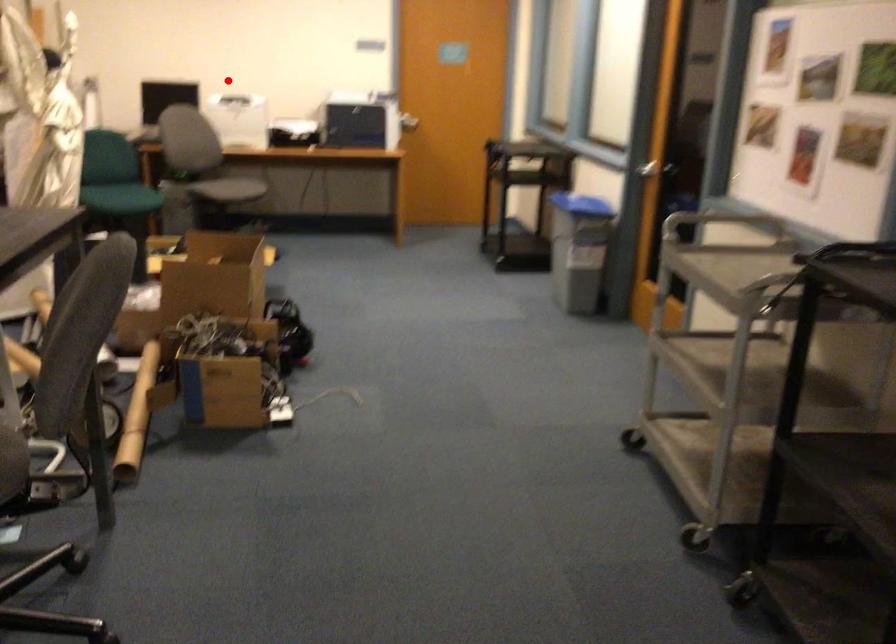
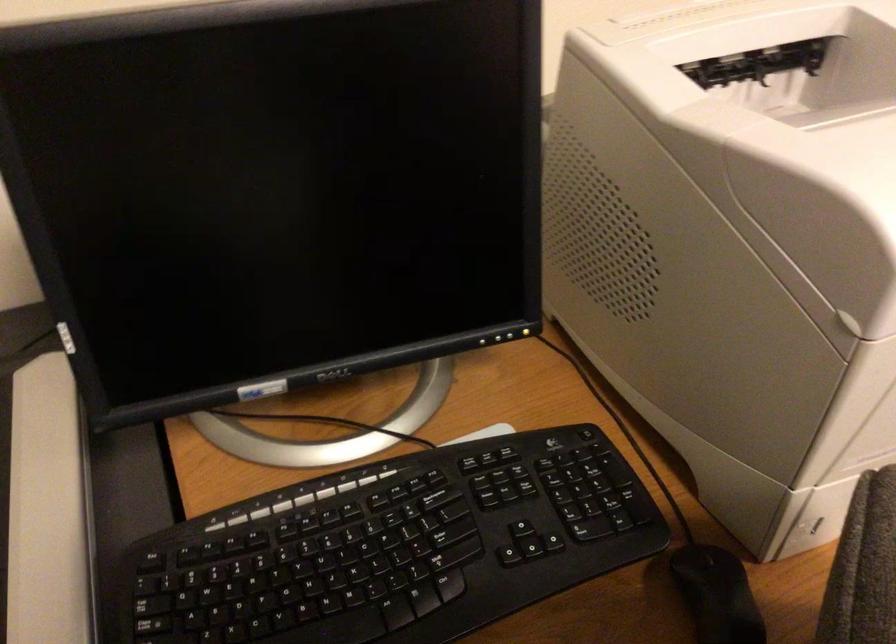
The point at the highlighted location is marked in the first image. Where is the corresponding point in the second image?

(616, 21)